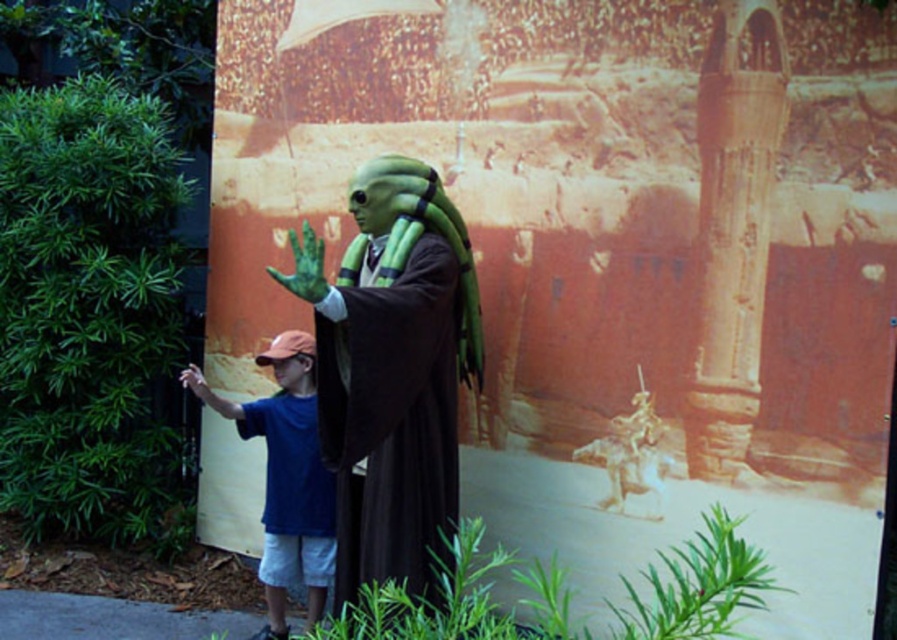
Question: Which of the following is the farthest from the observer?

Choices:
 (A) pyautogui.click(x=292, y=465)
 (B) pyautogui.click(x=340, y=456)
 (C) pyautogui.click(x=312, y=269)
 (D) pyautogui.click(x=203, y=380)

Answer: (D)

Question: Which object appears closest to the camera in this image?

Choices:
 (A) green matte hand at center
 (B) green matte alien at center
 (C) green matte hand at lower left

Answer: (A)

Question: Can you confirm if green matte alien at center is positioned above green matte hand at lower left?

Choices:
 (A) no
 (B) yes

Answer: (A)

Question: Which object is the closest to the blue cotton shirt at left?

Choices:
 (A) green matte hand at lower left
 (B) green matte hand at center

Answer: (A)

Question: Does green matte hand at center appear on the left side of green matte hand at lower left?

Choices:
 (A) yes
 (B) no

Answer: (B)

Question: Can you confirm if blue cotton shirt at left is bigger than green matte hand at center?

Choices:
 (A) no
 (B) yes

Answer: (B)